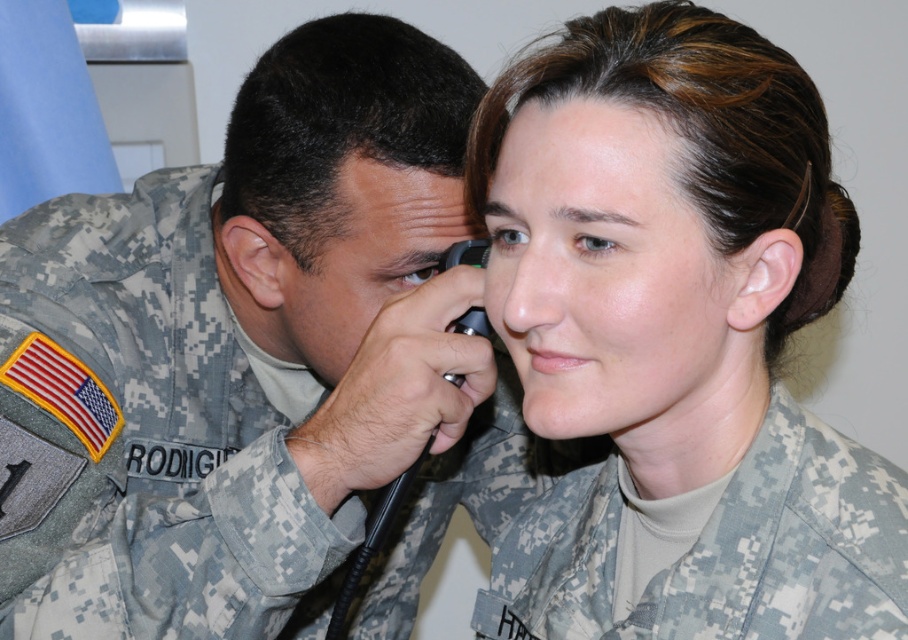
Question: Estimate the real-world distances between objects in this image. Which object is closer to the smooth skin at center?

Choices:
 (A) camouflage uniform at center
 (B) matte skin forehead at upper center
 (C) camouflage fabric uniform at center
 (D) camouflage uniform at left

Answer: (A)

Question: Which point is farther from the camera taking this photo?

Choices:
 (A) (583, 259)
 (B) (361, 236)
 (C) (285, 323)

Answer: (C)

Question: Does camouflage uniform at center appear on the right side of matte skin forehead at upper center?

Choices:
 (A) no
 (B) yes

Answer: (B)

Question: Is camouflage uniform at left thinner than matte skin forehead at upper center?

Choices:
 (A) yes
 (B) no

Answer: (B)

Question: Can you confirm if camouflage uniform at center is smaller than matte skin forehead at upper center?

Choices:
 (A) no
 (B) yes

Answer: (A)

Question: Based on their relative distances, which object is nearer to the smooth skin at center?

Choices:
 (A) camouflage fabric uniform at center
 (B) matte skin forehead at upper center
 (C) camouflage uniform at center
 (D) camouflage uniform at left

Answer: (C)